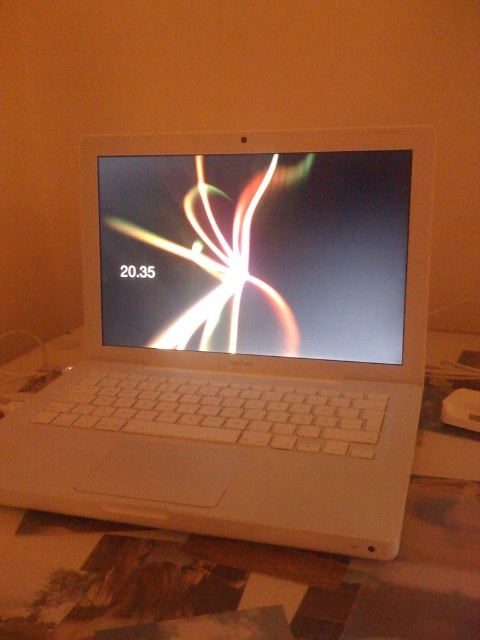
Question: Does white plastic laptop at center have a larger size compared to white plastic table at center?

Choices:
 (A) no
 (B) yes

Answer: (A)

Question: Can you confirm if matte plastic screen at center is smaller than white plastic table at center?

Choices:
 (A) yes
 (B) no

Answer: (A)

Question: Among these objects, which one is farthest from the camera?

Choices:
 (A) matte plastic screen at center
 (B) white plastic laptop at center

Answer: (A)

Question: Is white plastic laptop at center thinner than white plastic table at center?

Choices:
 (A) no
 (B) yes

Answer: (B)

Question: Which of the following is the closest to the observer?

Choices:
 (A) (338, 307)
 (B) (177, 605)
 (C) (104, 152)

Answer: (B)

Question: Which object is closer to the camera taking this photo?

Choices:
 (A) white plastic laptop at center
 (B) white plastic table at center
 (C) matte plastic screen at center

Answer: (B)